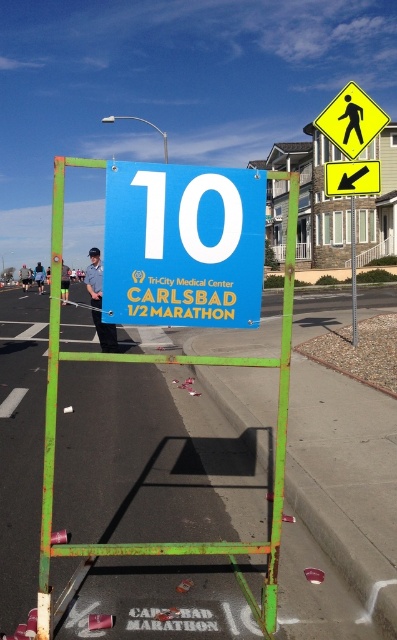
You are a runner participating in the Tri_City Medical Center Carlsbad 1 2 Marathon and you see the bright blue sign with large white numerals 10 at the top and the yellow diamond pedestrian sign at upper right. Which object is positioned higher on the image?

The yellow diamond pedestrian sign at upper right is located at point (350, 120), which has a higher y coordinate than the bright blue sign with large white numerals 10 at the top. Therefore, the yellow diamond pedestrian sign at upper right is positioned higher on the image.

You are a marathon participant approaching the green metal pole at center. You see the yellow diamond pedestrian sign at upper right. Is the sign positioned above or below the pole?

The yellow diamond pedestrian sign at upper right is located above the green metal pole at center.